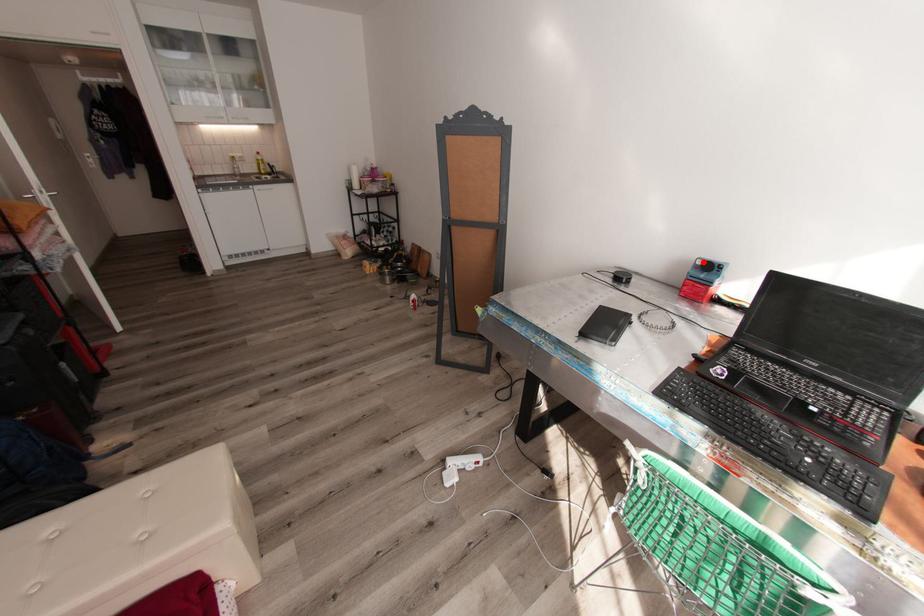
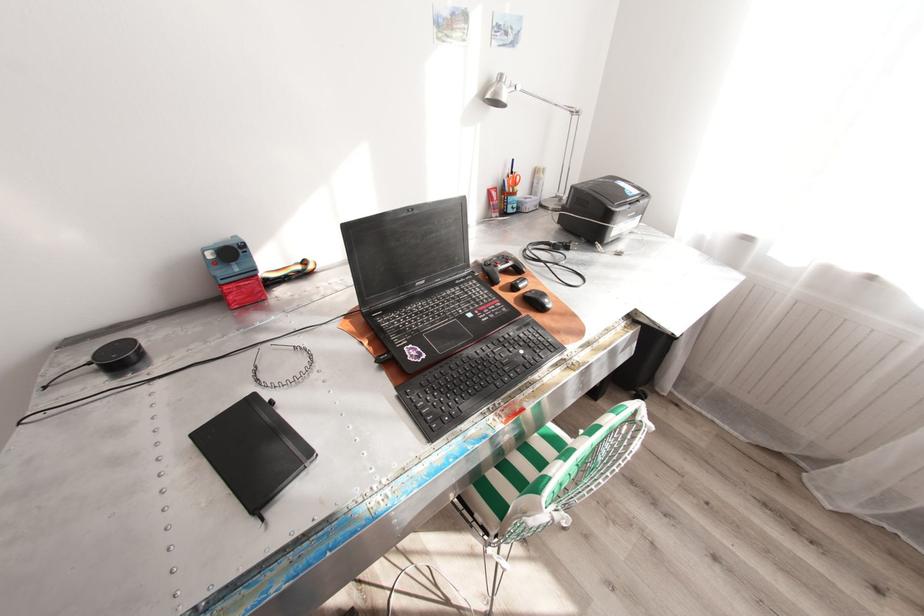
The point at the highlighted location is marked in the first image. Where is the corresponding point in the second image?

(215, 254)